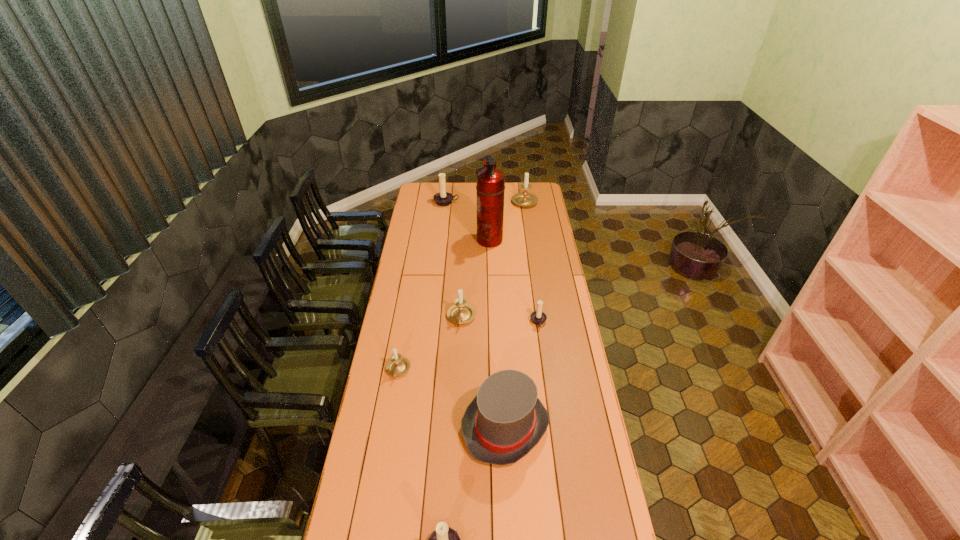
This screenshot has width=960, height=540. Identify the location of the nearest beige candle holder. (397, 365).

Identify the location of the smallest brown candle holder. The width and height of the screenshot is (960, 540). (538, 317).

The height and width of the screenshot is (540, 960). In order to click on the second farthest brown candle holder in this screenshot , I will do `click(538, 317)`.

At what (x,y) coordinates should I click in order to perform the action: click on vacant space situated on the side of the tallest object with the handle and hose. Please return your answer as a coordinate pair (x, y). This screenshot has width=960, height=540. Looking at the image, I should click on (468, 240).

Where is `vacant space located on the side of the tallest object with the handle and hose`? vacant space located on the side of the tallest object with the handle and hose is located at coordinates (423, 240).

At what (x,y) coordinates should I click in order to perform the action: click on free space located 0.280m on the side of the tallest object with the handle and hose. Please return your answer as a coordinate pair (x, y). This screenshot has height=540, width=960. Looking at the image, I should click on (427, 240).

Find the location of `free point located with a handle on the side of the farthest beige candle holder`. free point located with a handle on the side of the farthest beige candle holder is located at coordinates [522, 189].

Find the location of a particular element. This screenshot has height=540, width=960. vacant point located 0.150m on the wick of the farthest brown candle holder is located at coordinates (444, 221).

At what (x,y) coordinates should I click in order to perform the action: click on vacant space located on the back of the gray dress hat. Please return your answer as a coordinate pair (x, y). This screenshot has height=540, width=960. Looking at the image, I should click on (500, 321).

Where is `free space located 0.110m with a handle on the side of the second nearest beige candle holder`? Image resolution: width=960 pixels, height=540 pixels. free space located 0.110m with a handle on the side of the second nearest beige candle holder is located at coordinates (460, 349).